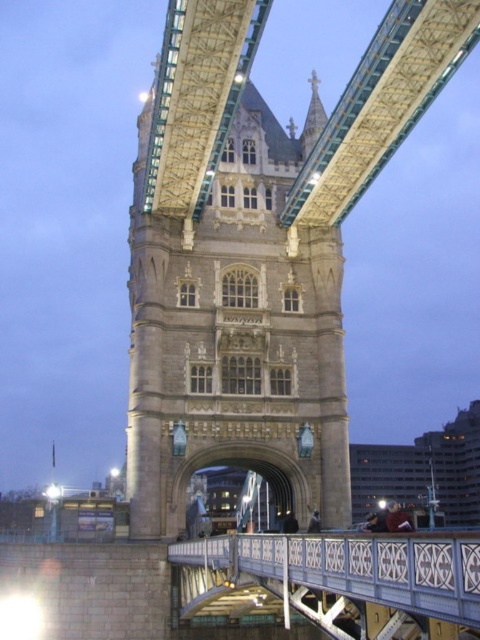
Is stone tower at center wider than white painted metal bridge at center?

No.

Does point (148, 144) come in front of point (410, 596)?

No, it is behind (410, 596).

I want to click on stone tower at center, so click(x=228, y=285).